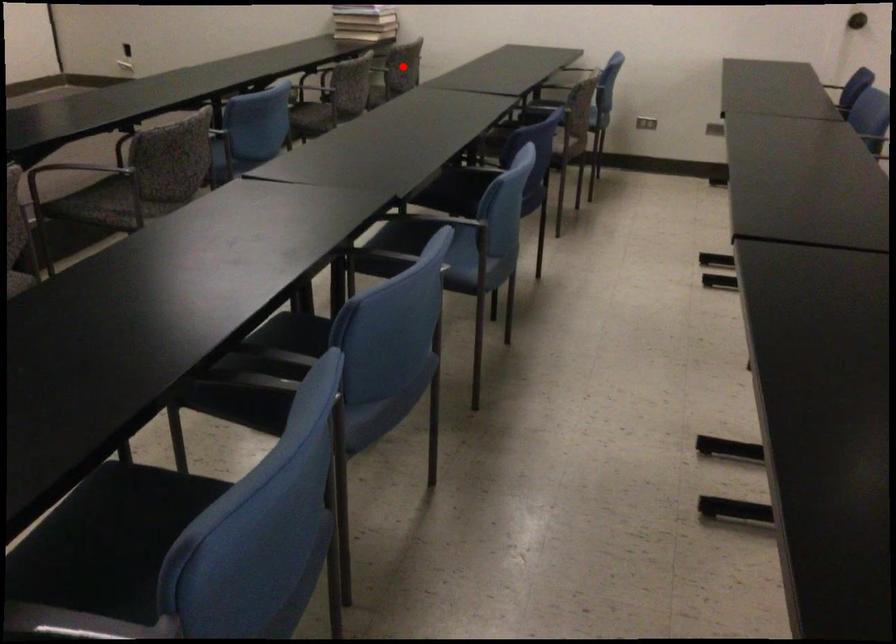
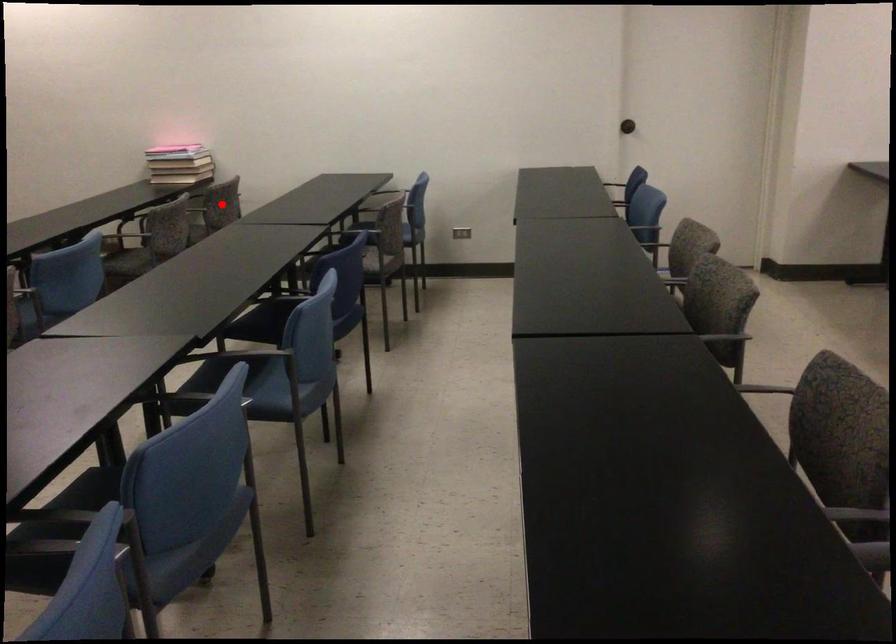
I am providing you with two images of the same scene from different viewpoints. A red point is marked on the first image and another point is marked on the second image. Do the highlighted points in image1 and image2 indicate the same real-world spot?

Yes